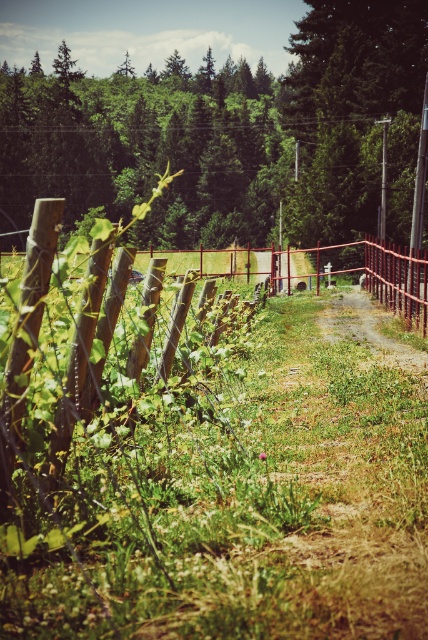
Can you confirm if green grass at lower left is taller than brown dirt track at center?

No, green grass at lower left is not taller than brown dirt track at center.

Can you confirm if green grass at lower left is positioned to the right of brown dirt track at center?

In fact, green grass at lower left is to the left of brown dirt track at center.

This screenshot has width=428, height=640. Find the location of `green grass at lower left`. green grass at lower left is located at coordinates [x=237, y=500].

Image resolution: width=428 pixels, height=640 pixels. Find the location of `green grass at lower left`. green grass at lower left is located at coordinates (237, 500).

Does green grass at lower left have a greater height compared to green leafy tree at upper center?

No.

Can you confirm if green grass at lower left is positioned below green leafy tree at upper center?

Yes, green grass at lower left is below green leafy tree at upper center.

Is point (252, 621) in front of point (152, 225)?

Yes, point (252, 621) is in front of point (152, 225).

In order to click on green grass at lower left in this screenshot , I will do `click(237, 500)`.

This screenshot has width=428, height=640. Describe the element at coordinates (229, 134) in the screenshot. I see `green leafy tree at upper center` at that location.

Can you confirm if green leafy tree at upper center is smaller than brown dirt track at center?

Incorrect, green leafy tree at upper center is not smaller in size than brown dirt track at center.

Does point (94, 125) lie behind point (380, 346)?

Yes, it is behind point (380, 346).

The height and width of the screenshot is (640, 428). Find the location of `green leafy tree at upper center`. green leafy tree at upper center is located at coordinates (229, 134).